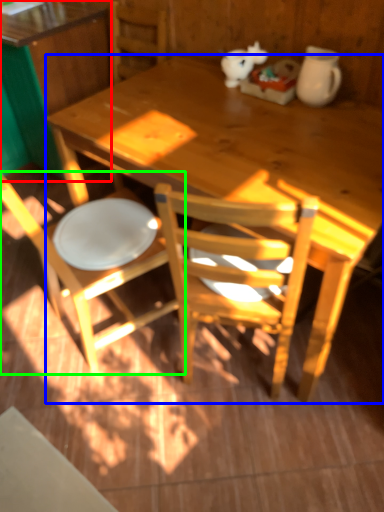
Question: Based on their relative distances, which object is farther from desk (highlighted by a red box)? Choose from desk (highlighted by a blue box) and chair (highlighted by a green box).

Choices:
 (A) desk
 (B) chair

Answer: (B)